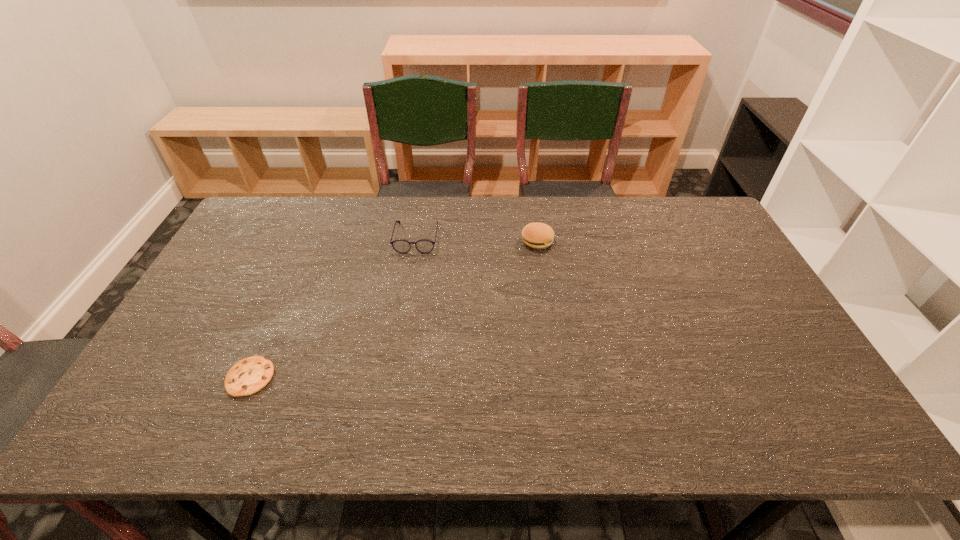
The width and height of the screenshot is (960, 540). What are the coordinates of `patty` in the screenshot? It's located at (536, 235).

Locate an element on the screen. This screenshot has width=960, height=540. spectacles is located at coordinates (402, 246).

Identify the location of cookie. Image resolution: width=960 pixels, height=540 pixels. (248, 376).

At what (x,y) coordinates should I click in order to perform the action: click on the nearest object. Please return your answer as a coordinate pair (x, y). This screenshot has height=540, width=960. Looking at the image, I should click on (248, 376).

The image size is (960, 540). I want to click on vacant space located 0.250m on the front of the patty, so click(547, 310).

Locate an element on the screen. This screenshot has width=960, height=540. vacant area situated on the front-facing side of the spectacles is located at coordinates (402, 325).

I want to click on vacant space located 0.080m on the front of the shortest object, so click(228, 430).

Locate an element on the screen. The height and width of the screenshot is (540, 960). patty positioned at the far edge is located at coordinates (536, 235).

Identify the location of spectacles at the far edge. (402, 246).

Where is `free space at the far edge`? This screenshot has height=540, width=960. free space at the far edge is located at coordinates (627, 201).